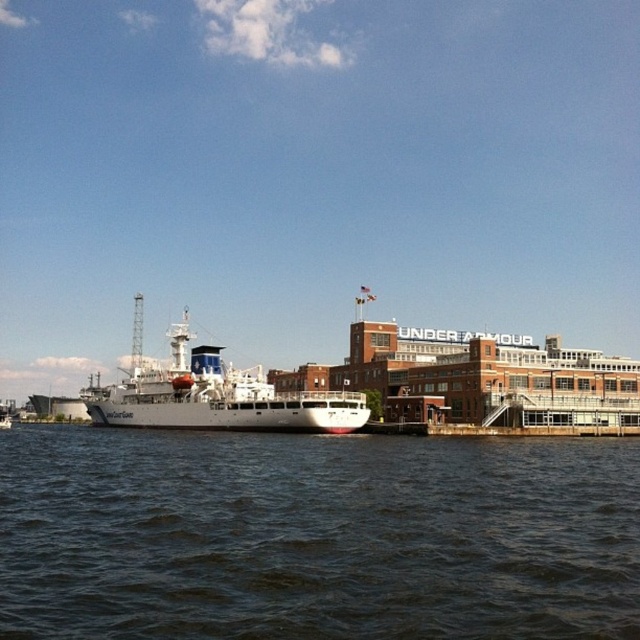
You are standing on the pier and looking at the dark blue water at lower center and the white matte ship at center. Which object appears taller from your viewpoint?

The white matte ship at center appears taller than the dark blue water at lower center because the description states that the dark blue water at lower center has a lesser height compared to the white matte ship at center.

You are a photographer planning to take a wide shot of the waterfront scene. You want to ensure that both the dark blue water at lower center and the white matte ship at center are fully visible in the frame. Based on their relative widths, which object should you prioritize positioning closer to the center of your camera frame to avoid cropping?

The dark blue water at lower center might be wider than the white matte ship at center, so to avoid cropping, prioritize positioning the dark blue water at lower center closer to the center of the camera frame since it occupies more width in the scene.